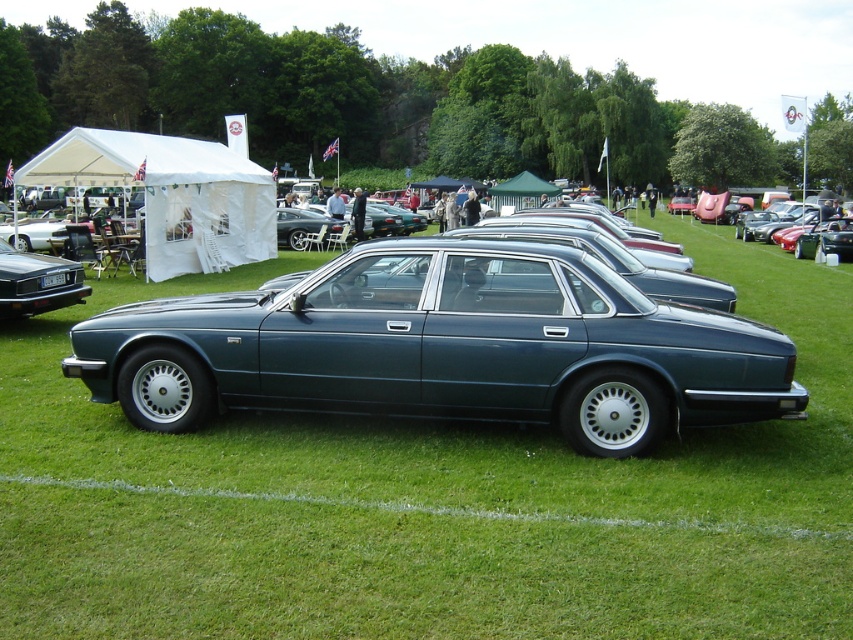
You are standing at the point labeled point [67,273] in the image. You want to walk to the point labeled point [71,294]. Which direction should you face to move towards that point?

To move from point [67,273] to point [71,294], you should face towards the right direction since point [71,294] is located to the right of point [67,273].

From the picture: You are a photographer at the car event. You need to capture a photo of the metallic blue sedan at center and the black plastic license plate at center. Which object will appear larger in the photo?

The metallic blue sedan at center is taller than the black plastic license plate at center, so it will appear larger in the photo.

Looking at this image, you are a photographer at the car event and want to capture the metallic blue sedan at center without the black plastic license plate at center appearing in the shot. How can you adjust your camera angle to achieve this?

Since the metallic blue sedan at center is above the black plastic license plate at center, you can angle your camera upwards to focus on the sedan while avoiding the license plate below it.